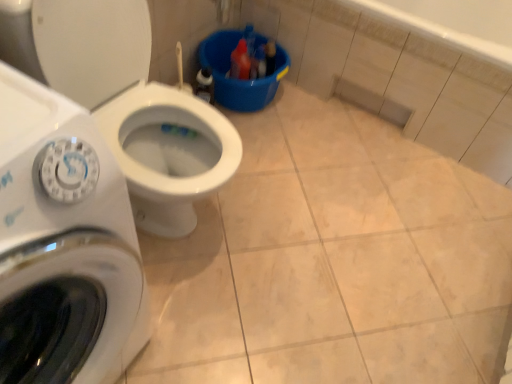
In the scene shown: In order to face white glossy washing machine at left, should I rotate leftwards or rightwards?

To face it directly, rotate left by 28.553 degrees.

What do you see at coordinates (64, 244) in the screenshot?
I see `white glossy washing machine at left` at bounding box center [64, 244].

Image resolution: width=512 pixels, height=384 pixels. I want to click on white glossy washing machine at left, so [64, 244].

The height and width of the screenshot is (384, 512). I want to click on white glossy toilet at center-left, so click(x=125, y=101).

The width and height of the screenshot is (512, 384). Describe the element at coordinates (125, 101) in the screenshot. I see `white glossy toilet at center-left` at that location.

What is the approximate height of white glossy toilet at center-left?

32.90 inches.

In order to face white glossy toilet at center-left, should I rotate leftwards or rightwards?

To face it directly, rotate left by 15.033 degrees.

Identify the location of white glossy washing machine at left. The image size is (512, 384). (64, 244).

Is white glossy washing machine at left to the right of white glossy toilet at center-left from the viewer's perspective?

No, white glossy washing machine at left is not to the right of white glossy toilet at center-left.

Is the depth of white glossy washing machine at left less than that of white glossy toilet at center-left?

That is True.

Between point (38, 334) and point (106, 36), which one is positioned behind?

The point (106, 36) is farther.

From the image's perspective, is white glossy washing machine at left on white glossy toilet at center-left?

Actually, white glossy washing machine at left appears below white glossy toilet at center-left in the image.

From a real-world perspective, between white glossy washing machine at left and white glossy toilet at center-left, who is vertically lower?

From a 3D spatial view, white glossy toilet at center-left is below.

Considering the sizes of white glossy washing machine at left and white glossy toilet at center-left in the image, is white glossy washing machine at left wider or thinner than white glossy toilet at center-left?

Considering their sizes, white glossy washing machine at left looks slimmer than white glossy toilet at center-left.

Does white glossy washing machine at left have a greater height compared to white glossy toilet at center-left?

Correct, white glossy washing machine at left is much taller as white glossy toilet at center-left.

Is white glossy washing machine at left smaller than white glossy toilet at center-left?

Indeed, white glossy washing machine at left has a smaller size compared to white glossy toilet at center-left.

Is white glossy washing machine at left not within white glossy toilet at center-left?

Yes, white glossy washing machine at left is outside of white glossy toilet at center-left.

Would you say white glossy washing machine at left is a long distance from white glossy toilet at center-left?

No, white glossy washing machine at left is not far from white glossy toilet at center-left.

Is white glossy washing machine at left facing towards white glossy toilet at center-left?

No, white glossy washing machine at left is not aimed at white glossy toilet at center-left.

Can you tell me how much white glossy washing machine at left and white glossy toilet at center-left differ in facing direction?

They differ by 0.485 degrees in their facing directions.

How far apart are white glossy washing machine at left and white glossy toilet at center-left?

A distance of 18.10 inches exists between white glossy washing machine at left and white glossy toilet at center-left.

Image resolution: width=512 pixels, height=384 pixels. I want to click on washing machine on the left of the white glossy toilet at center-left, so click(x=64, y=244).

Which is more to the right, white glossy toilet at center-left or white glossy washing machine at left?

white glossy toilet at center-left is more to the right.

Which object is further away from the camera taking this photo, white glossy toilet at center-left or white glossy washing machine at left?

white glossy toilet at center-left is behind.

Considering the points (15, 20) and (80, 265), which point is in front, point (15, 20) or point (80, 265)?

The point (80, 265) is more forward.

From the image's perspective, between white glossy toilet at center-left and white glossy washing machine at left, who is located below?

white glossy washing machine at left appears lower in the image.

From a real-world perspective, who is located higher, white glossy toilet at center-left or white glossy washing machine at left?

In real-world perspective, white glossy washing machine at left is above.

Considering the sizes of objects white glossy toilet at center-left and white glossy washing machine at left in the image provided, who is wider, white glossy toilet at center-left or white glossy washing machine at left?

With larger width is white glossy toilet at center-left.

Can you confirm if white glossy toilet at center-left is shorter than white glossy washing machine at left?

Correct, white glossy toilet at center-left is not as tall as white glossy washing machine at left.

Does white glossy toilet at center-left have a smaller size compared to white glossy washing machine at left?

No, white glossy toilet at center-left is not smaller than white glossy washing machine at left.

Is white glossy toilet at center-left situated inside white glossy washing machine at left or outside?

white glossy toilet at center-left lies outside white glossy washing machine at left.

Is white glossy toilet at center-left with white glossy washing machine at left?

No, white glossy toilet at center-left is not in contact with white glossy washing machine at left.

Is white glossy toilet at center-left oriented towards white glossy washing machine at left?

No.

Based on the photo, can you tell me how much white glossy toilet at center-left and white glossy washing machine at left differ in facing direction?

0.485 degrees.

The height and width of the screenshot is (384, 512). In order to click on toilet below the white glossy washing machine at left (from a real-world perspective) in this screenshot , I will do 125,101.

Find the location of a particular element. The width and height of the screenshot is (512, 384). washing machine in front of the white glossy toilet at center-left is located at coordinates (64, 244).

You are a GUI agent. You are given a task and a screenshot of the screen. Output one action in this format:
    pyautogui.click(x=<x>, y=<y>)
    Task: Click on the washing machine on the left of white glossy toilet at center-left
    The height and width of the screenshot is (384, 512).
    Given the screenshot: What is the action you would take?
    pyautogui.click(x=64, y=244)